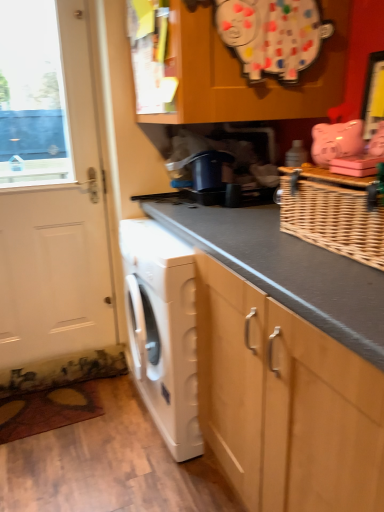
Question: Is woven brown basket at upper right situated inside white matte door at left or outside?

Choices:
 (A) outside
 (B) inside

Answer: (A)

Question: Is woven brown basket at upper right bigger or smaller than white matte door at left?

Choices:
 (A) small
 (B) big

Answer: (A)

Question: Which object is positioned closest to the woven brown basket at upper right?

Choices:
 (A) white matte washing machine at lower left
 (B) white matte door at left
 (C) wooden cabinet at upper center

Answer: (C)

Question: Which is farther from the white matte washing machine at lower left?

Choices:
 (A) white matte door at left
 (B) wooden cabinet at upper center
 (C) woven brown basket at upper right

Answer: (B)